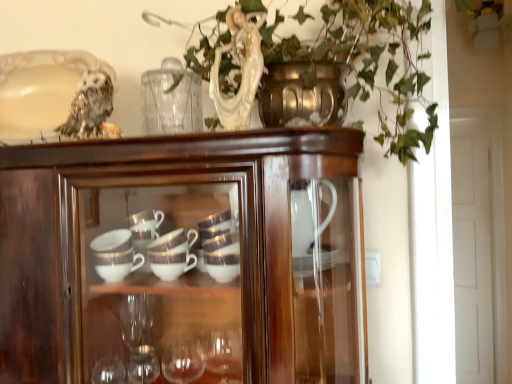
Question: Is glossy wood cupboard at center closer to the viewer compared to sparkly silver owl at upper left?

Choices:
 (A) yes
 (B) no

Answer: (A)

Question: Considering the relative sizes of glossy wood cupboard at center and sparkly silver owl at upper left in the image provided, is glossy wood cupboard at center bigger than sparkly silver owl at upper left?

Choices:
 (A) no
 (B) yes

Answer: (B)

Question: Considering the relative sizes of glossy wood cupboard at center and sparkly silver owl at upper left in the image provided, is glossy wood cupboard at center thinner than sparkly silver owl at upper left?

Choices:
 (A) no
 (B) yes

Answer: (A)

Question: Could you tell me if glossy wood cupboard at center is turned towards sparkly silver owl at upper left?

Choices:
 (A) yes
 (B) no

Answer: (B)

Question: Is glossy wood cupboard at center facing away from sparkly silver owl at upper left?

Choices:
 (A) no
 (B) yes

Answer: (A)

Question: From a real-world perspective, is sparkly silver owl at upper left positioned above or below white glossy door at right?

Choices:
 (A) below
 (B) above

Answer: (B)

Question: In terms of width, does sparkly silver owl at upper left look wider or thinner when compared to white glossy door at right?

Choices:
 (A) wide
 (B) thin

Answer: (A)

Question: Is point (97, 104) closer or farther from the camera than point (463, 344)?

Choices:
 (A) closer
 (B) farther

Answer: (A)

Question: In the image, is sparkly silver owl at upper left positioned in front of or behind white glossy door at right?

Choices:
 (A) behind
 (B) front

Answer: (B)

Question: Looking at their shapes, would you say glossy wood cupboard at center is wider or thinner than sparkly silver owl at upper left?

Choices:
 (A) wide
 (B) thin

Answer: (A)

Question: In terms of size, does glossy wood cupboard at center appear bigger or smaller than sparkly silver owl at upper left?

Choices:
 (A) big
 (B) small

Answer: (A)

Question: Is glossy wood cupboard at center taller or shorter than sparkly silver owl at upper left?

Choices:
 (A) tall
 (B) short

Answer: (A)

Question: Is glossy wood cupboard at center in front of or behind sparkly silver owl at upper left in the image?

Choices:
 (A) behind
 (B) front

Answer: (B)

Question: Is glossy wood cupboard at center to the left or to the right of white glossy door at right in the image?

Choices:
 (A) left
 (B) right

Answer: (A)

Question: In terms of height, does glossy wood cupboard at center look taller or shorter compared to white glossy door at right?

Choices:
 (A) short
 (B) tall

Answer: (A)